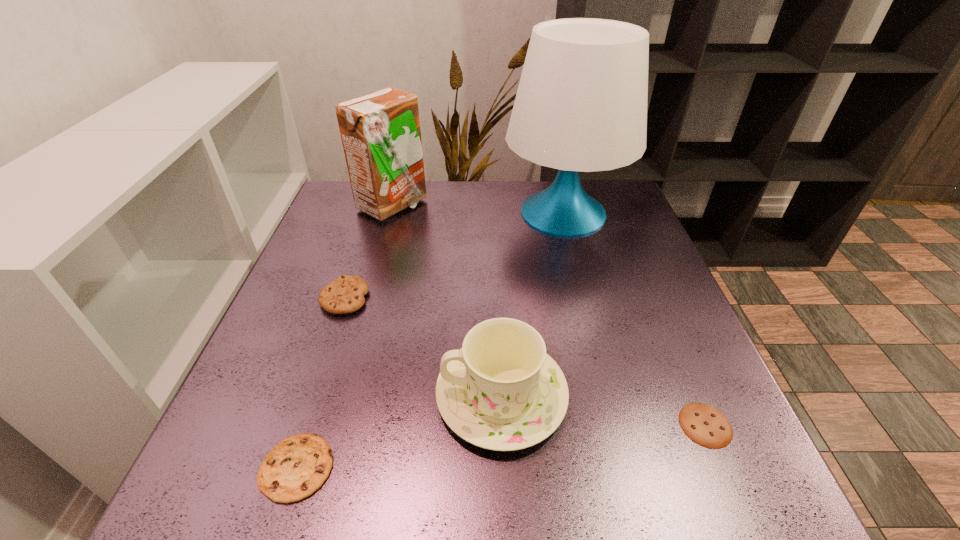
This screenshot has height=540, width=960. Find the location of `the tallest object`. the tallest object is located at coordinates (581, 105).

Where is `the second tallest object`? This screenshot has width=960, height=540. the second tallest object is located at coordinates (381, 136).

Where is `the third tallest object`? The image size is (960, 540). the third tallest object is located at coordinates (501, 391).

Identify the location of the third shortest object. click(345, 294).

Find the location of a particular element. This screenshot has height=540, width=960. the farthest cookie is located at coordinates (345, 294).

The height and width of the screenshot is (540, 960). I want to click on the fifth tallest object, so click(295, 468).

This screenshot has width=960, height=540. I want to click on the shortest object, so click(x=705, y=425).

The width and height of the screenshot is (960, 540). In order to click on the rightmost cookie in this screenshot , I will do (x=705, y=425).

Where is `free space located on the front-facing side of the table lamp`? free space located on the front-facing side of the table lamp is located at coordinates (591, 318).

The image size is (960, 540). I want to click on free space located 0.260m on the straw side of the fifth shortest object, so click(x=518, y=206).